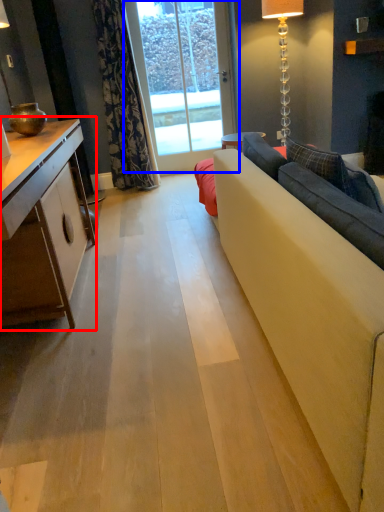
Question: Which object appears farthest to the camera in this image, cabinetry (highlighted by a red box) or window screen (highlighted by a blue box)?

Choices:
 (A) cabinetry
 (B) window screen

Answer: (B)